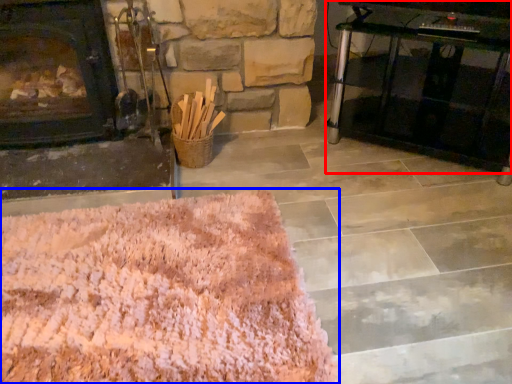
Question: Which of the following is the farthest to the observer, table (highlighted by a red box) or mat (highlighted by a blue box)?

Choices:
 (A) table
 (B) mat

Answer: (A)